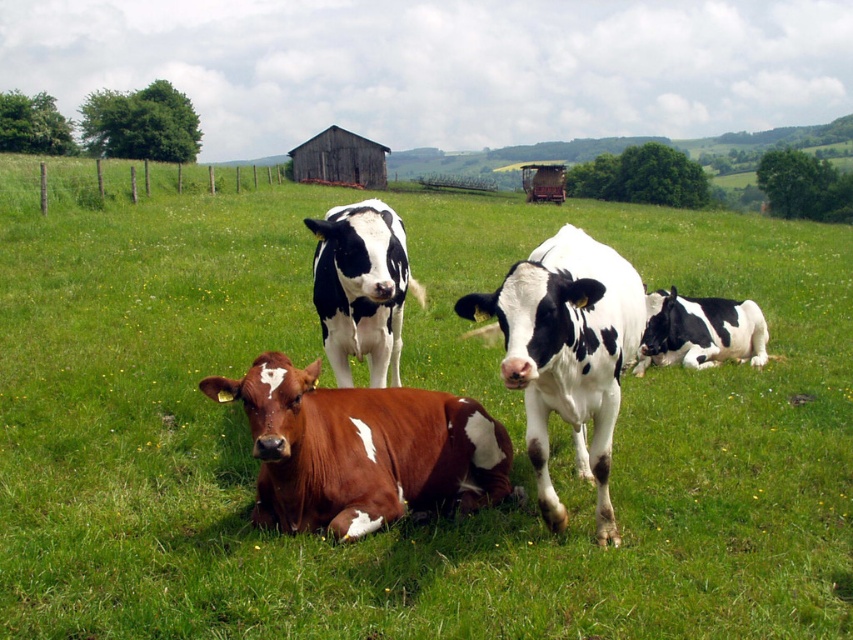
You are standing at the point marked by the coordinate point at point (361, 449). Which cow is directly in front of you?

Answer: The brown speckled cow at center is located at point (361, 449), so the cow directly in front of you is the brown speckled cow at center.